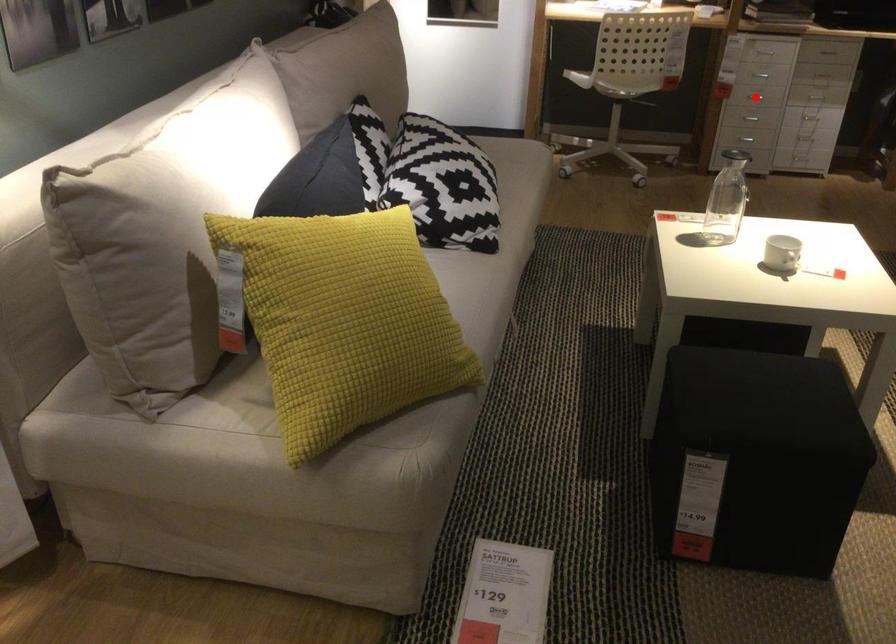
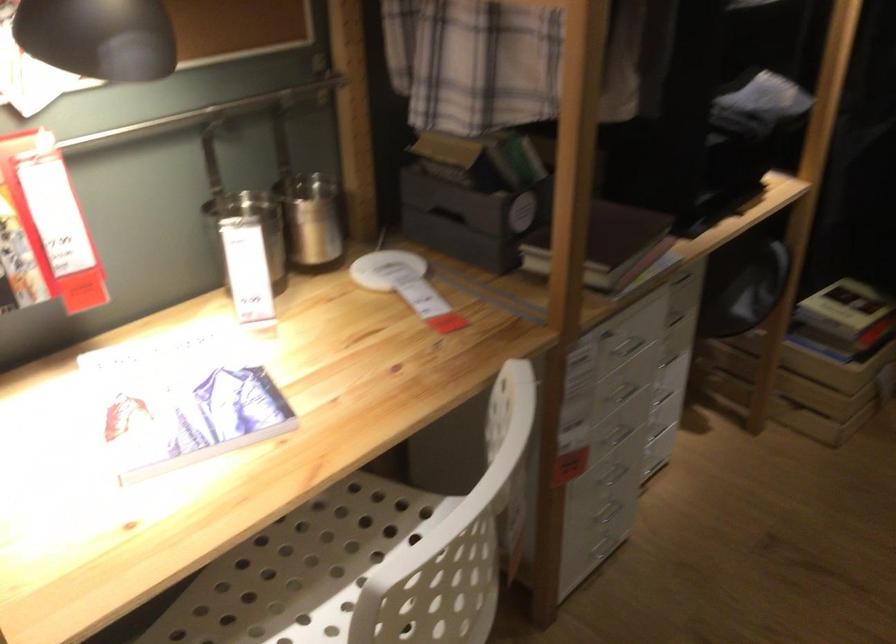
Question: I am providing you with two images of the same scene from different viewpoints. A red point is marked on the first image. At the location where the point appears in image 1, is it still visible in image 2?

Choices:
 (A) Yes
 (B) No

Answer: (B)